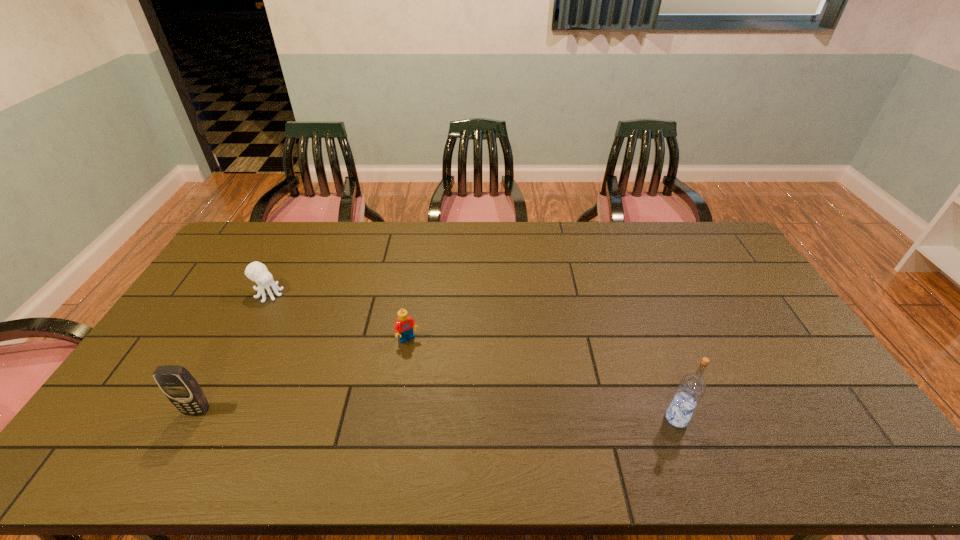
The width and height of the screenshot is (960, 540). I want to click on vacant space on the desktop that is between the third shortest object and the rightmost object and is positioned on the face of the second object from right to left, so click(457, 415).

I want to click on free space on the desktop that is between the second tallest object and the rightmost object and is positioned on the front-facing side of the farthest object, so click(472, 415).